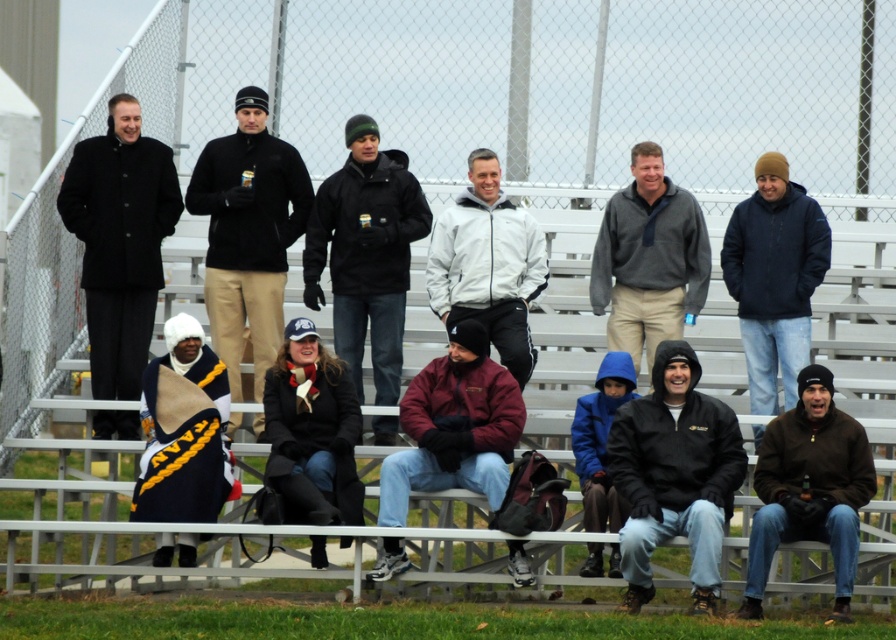
Can you confirm if dark gray fleece jacket at center is smaller than brown fuzzy jacket at lower right?

Actually, dark gray fleece jacket at center might be larger than brown fuzzy jacket at lower right.

Is point (383, 388) positioned in front of point (840, 614)?

No.

Find the location of a particular element. The width and height of the screenshot is (896, 640). dark gray fleece jacket at center is located at coordinates (366, 253).

Is black matte coat at left further to camera compared to white matte jacket at center?

Yes, black matte coat at left is further from the viewer.

From the picture: Who is more forward, (93, 136) or (513, 369)?

Positioned in front is point (513, 369).

Where is `black matte coat at left`? black matte coat at left is located at coordinates (119, 241).

This screenshot has height=640, width=896. What are the coordinates of `black matte coat at left` in the screenshot? It's located at (119, 241).

Is dark gray fleece jacket at center bigger than white matte jacket at center?

Correct, dark gray fleece jacket at center is larger in size than white matte jacket at center.

Between dark gray fleece jacket at center and white matte jacket at center, which one appears on the right side from the viewer's perspective?

From the viewer's perspective, white matte jacket at center appears more on the right side.

Is point (352, 221) farther from viewer compared to point (438, 296)?

Yes, point (352, 221) is behind point (438, 296).

Locate an element on the screen. dark gray fleece jacket at center is located at coordinates (366, 253).